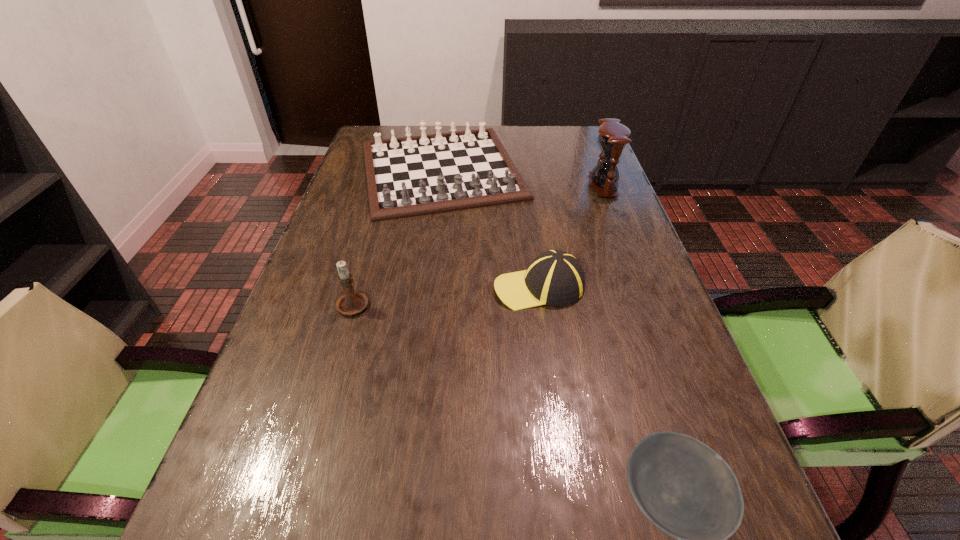
Where is `free spot between the tallest object and the fourth shortest object`? The height and width of the screenshot is (540, 960). free spot between the tallest object and the fourth shortest object is located at coordinates point(478,244).

What are the coordinates of `free space that is in between the baseball cap and the candle holder` in the screenshot? It's located at (446, 295).

This screenshot has width=960, height=540. Identify the location of free space between the baseball cap and the candle holder. (446, 295).

The height and width of the screenshot is (540, 960). What are the coordinates of `free space between the hourglass and the baseball cap` in the screenshot? It's located at (571, 236).

At what (x,y) coordinates should I click in order to perform the action: click on vacant area that lies between the baseball cap and the hourglass. Please return your answer as a coordinate pair (x, y). This screenshot has width=960, height=540. Looking at the image, I should click on (571, 236).

Locate an element on the screen. free spot between the baseball cap and the second tallest object is located at coordinates (446, 295).

At what (x,y) coordinates should I click in order to perform the action: click on free space between the second tallest object and the hourglass. Please return your answer as a coordinate pair (x, y). The image size is (960, 540). Looking at the image, I should click on (478, 244).

You are a GUI agent. You are given a task and a screenshot of the screen. Output one action in this format:
    pyautogui.click(x=<x>, y=<y>)
    Task: Click on the second closest object to the chessboard
    The height and width of the screenshot is (540, 960).
    Given the screenshot: What is the action you would take?
    pyautogui.click(x=555, y=277)

You are a GUI agent. You are given a task and a screenshot of the screen. Output one action in this format:
    pyautogui.click(x=<x>, y=<y>)
    Task: Click on the object that is the fourth closest one to the chessboard
    The height and width of the screenshot is (540, 960).
    Given the screenshot: What is the action you would take?
    pyautogui.click(x=682, y=486)

At what (x,y) coordinates should I click in order to perform the action: click on free location that satisfies the following two spatial constraints: 1. on the side of the hourglass with the handle; 2. on the right side of the candle holder. Please return your answer as a coordinate pair (x, y). This screenshot has height=540, width=960. Looking at the image, I should click on (388, 185).